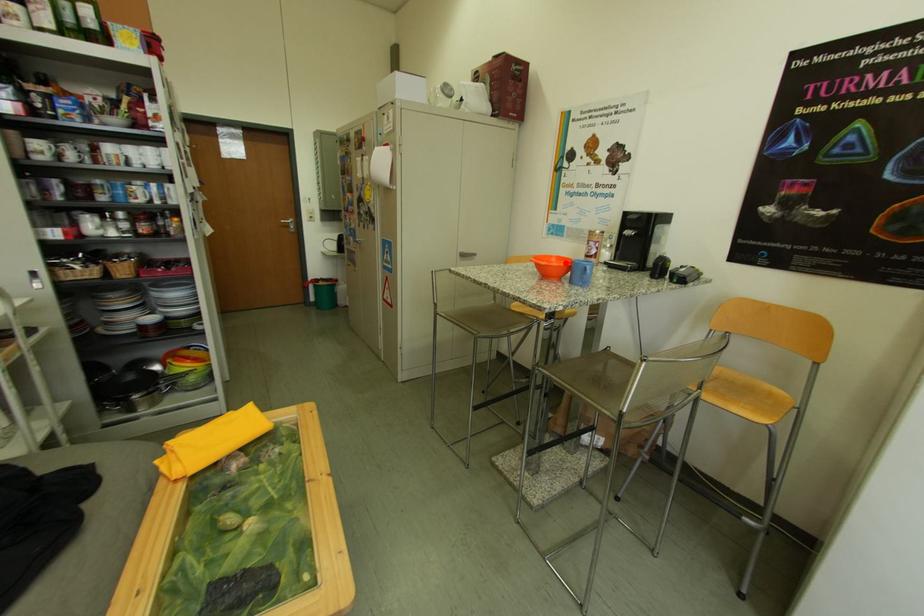
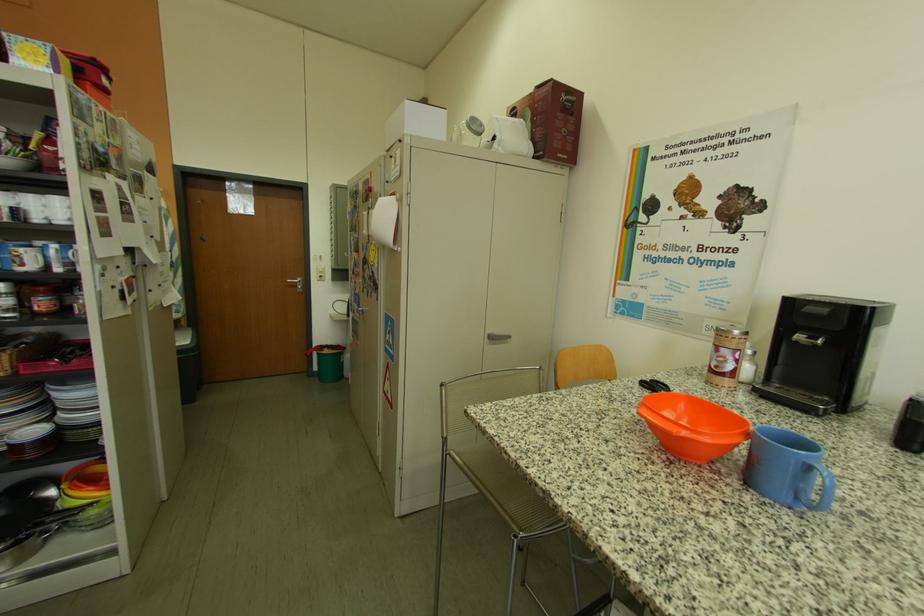
In the second image, find the point that corresponds to the highlighted location in the first image.

(695, 408)